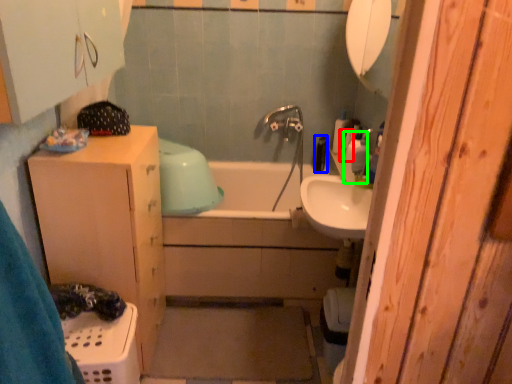
Question: Estimate the real-world distances between objects in this image. Which object is closer to toiletry (highlighted by a red box), toiletry (highlighted by a blue box) or soap dispenser (highlighted by a green box)?

Choices:
 (A) toiletry
 (B) soap dispenser

Answer: (B)